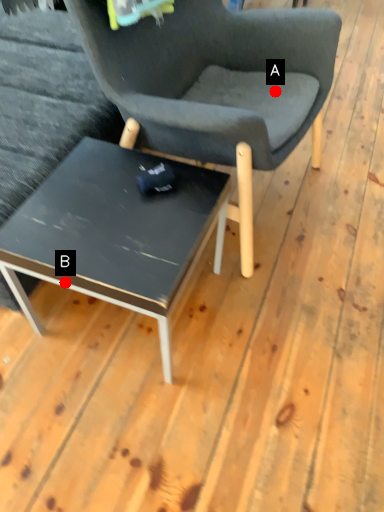
Question: Two points are circled on the image, labeled by A and B beside each circle. Which of the following is the farthest from the observer?

Choices:
 (A) A is further
 (B) B is further

Answer: (A)